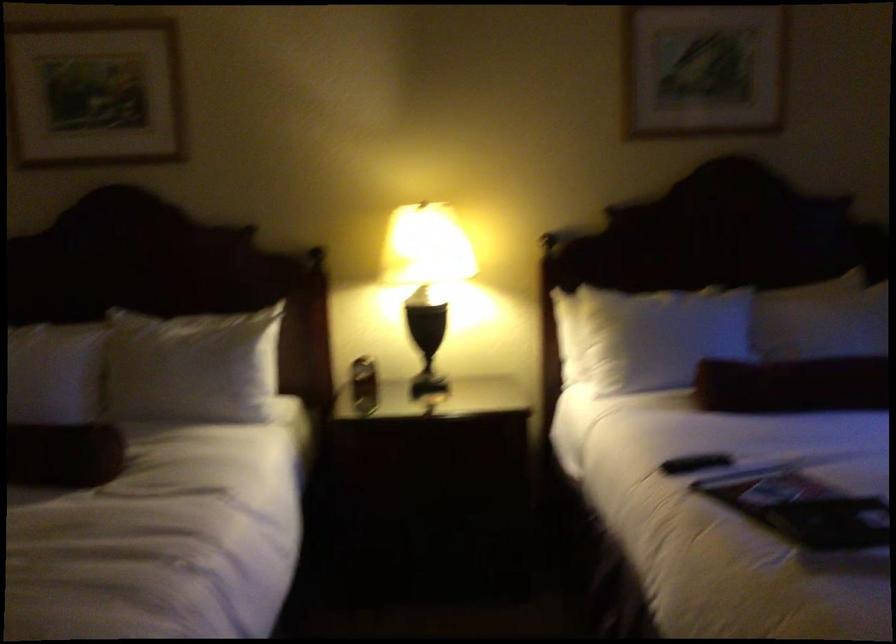
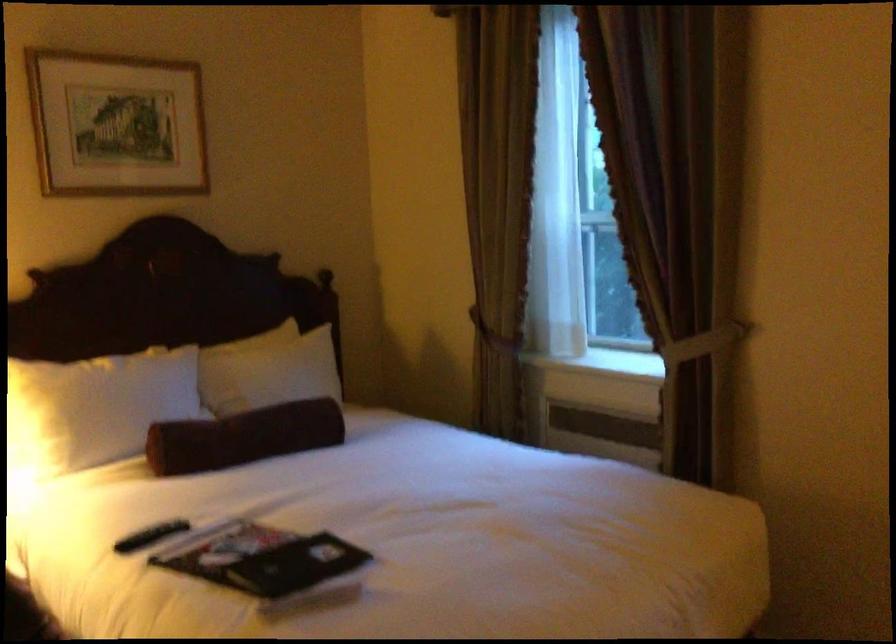
Locate, in the second image, the point that corresponds to pixel 651 333 in the first image.

(95, 408)